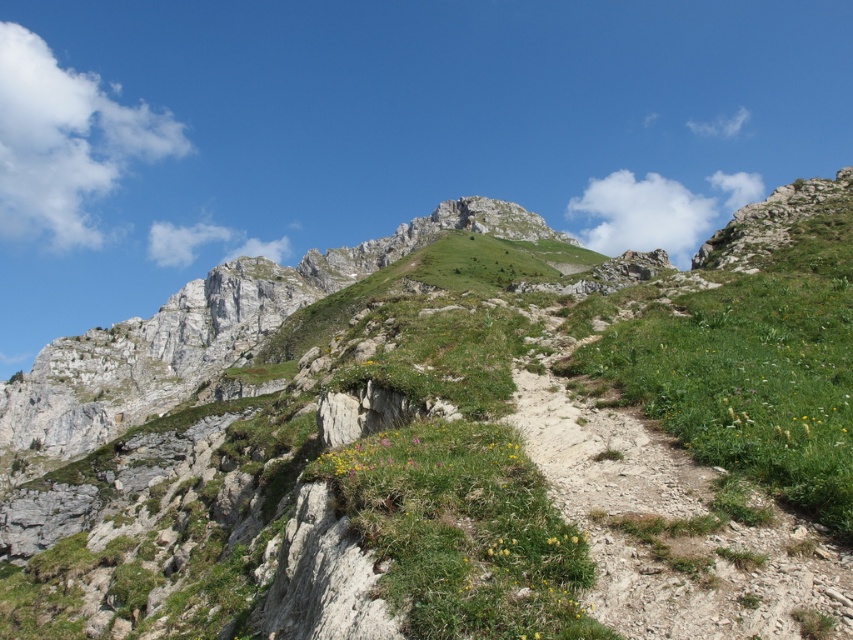
Which is behind, point (527, 257) or point (851, 592)?

The point (527, 257) is behind.

Is green grassy mountain at upper center taller than dusty gravel trail at center-right?

Correct, green grassy mountain at upper center is much taller as dusty gravel trail at center-right.

Is point (22, 419) closer to camera compared to point (607, 483)?

That is False.

This screenshot has width=853, height=640. I want to click on green grassy mountain at upper center, so click(450, 442).